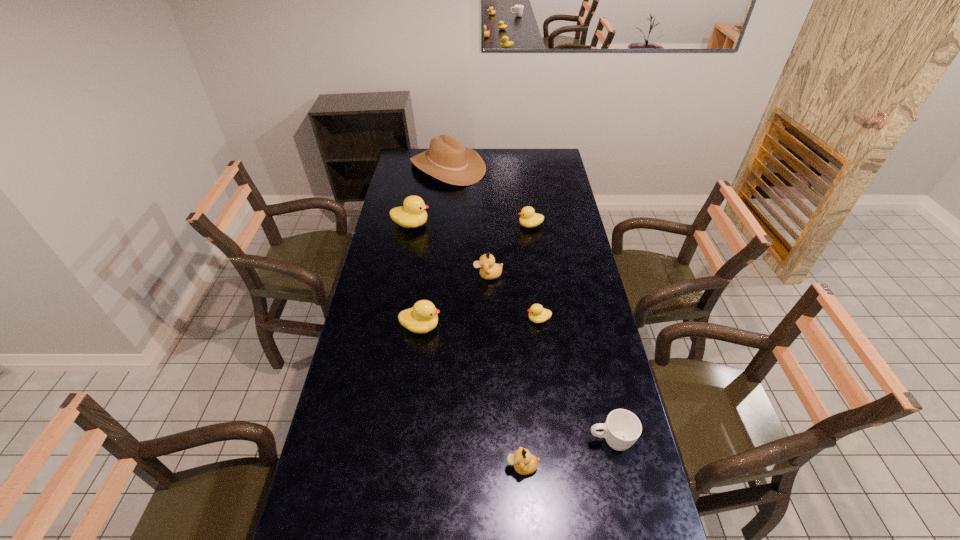
Select which yellow duckling appears as the second closest to the farthest object. Please provide its 2D coordinates. Your answer should be formatted as a tuple, i.e. [(x, y)], where the tuple contains the x and y coordinates of a point satisfying the conditions above.

[(530, 219)]

The width and height of the screenshot is (960, 540). What are the coordinates of `yellow duckling that is the second closest to the tallest duckling` in the screenshot? It's located at (422, 317).